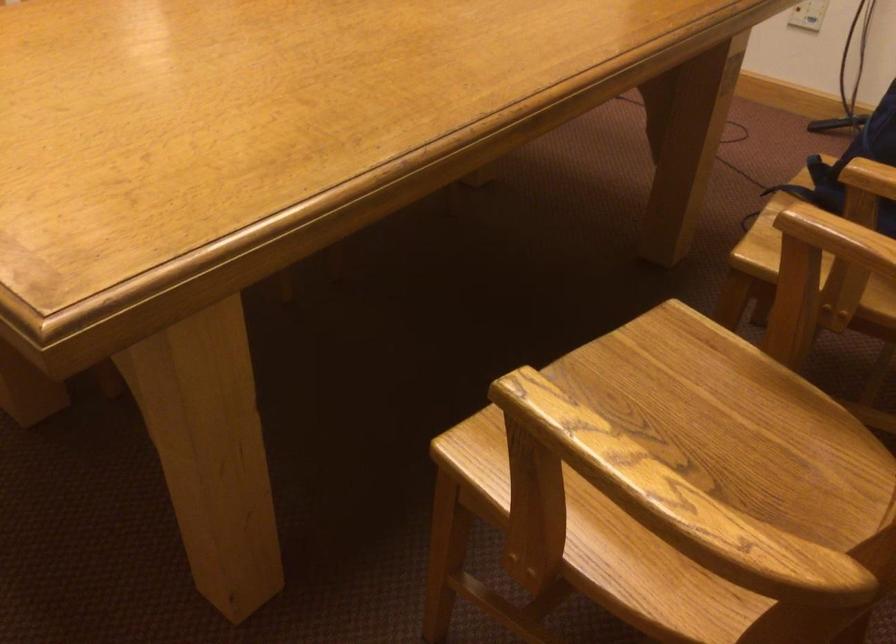
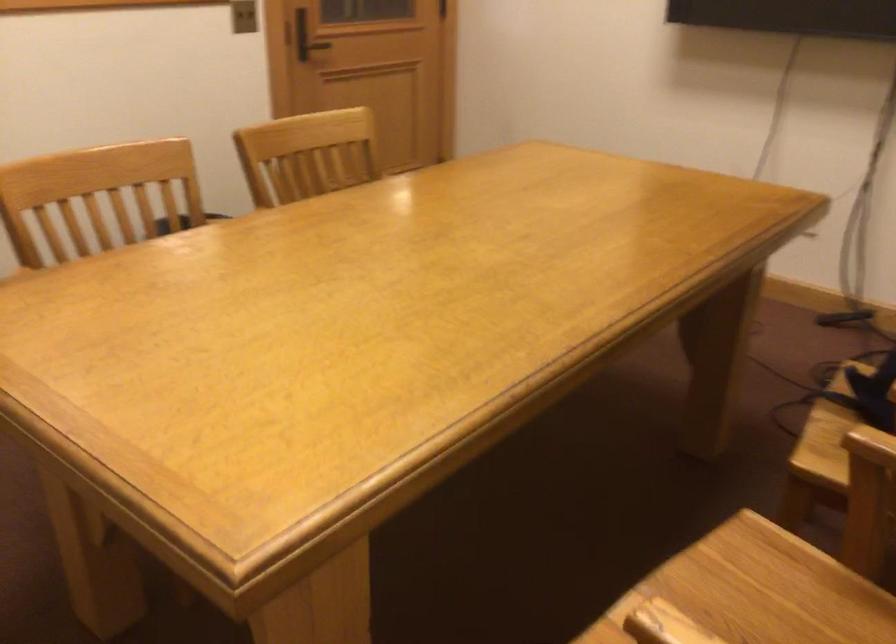
Where in the second image is the point corresponding to the point at 683,371 from the first image?

(764, 588)